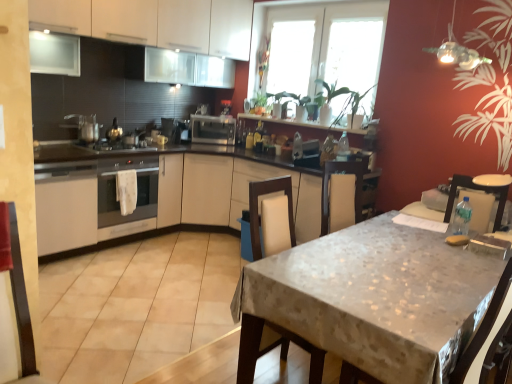
Question: Is satin silver toaster at center, the 3th appliance when ordered from right to left, positioned before white matte cabinet at upper left, the 2th cabinetry when ordered from bottom to top?

Choices:
 (A) yes
 (B) no

Answer: (B)

Question: Is satin silver toaster at center, the second appliance in the back-to-front sequence, at the left side of white matte cabinet at upper left, placed as the 1th cabinetry when sorted from top to bottom?

Choices:
 (A) yes
 (B) no

Answer: (A)

Question: Can you confirm if satin silver toaster at center, which is the second appliance from front to back, is bigger than white matte cabinet at upper left, the 2th cabinetry when ordered from bottom to top?

Choices:
 (A) yes
 (B) no

Answer: (B)

Question: From the image's perspective, would you say satin silver toaster at center, the second appliance in the back-to-front sequence, is shown under white matte cabinet at upper left, the 2th cabinetry when ordered from bottom to top?

Choices:
 (A) yes
 (B) no

Answer: (A)

Question: Is satin silver toaster at center, the second appliance in the back-to-front sequence, in contact with white matte cabinet at upper left, placed as the 1th cabinetry when sorted from top to bottom?

Choices:
 (A) yes
 (B) no

Answer: (B)

Question: From the image's perspective, is textured beige table at center located above or below satin silver toaster at center, the second appliance in the back-to-front sequence?

Choices:
 (A) below
 (B) above

Answer: (A)

Question: Is textured beige table at center inside or outside of satin silver toaster at center, the 3th appliance when ordered from right to left?

Choices:
 (A) outside
 (B) inside

Answer: (A)

Question: In the image, is textured beige table at center positioned in front of or behind satin silver toaster at center, which is the second appliance from front to back?

Choices:
 (A) behind
 (B) front

Answer: (B)

Question: Visually, is textured beige table at center positioned to the left or to the right of satin silver toaster at center, which ranks as the 1th appliance in left-to-right order?

Choices:
 (A) left
 (B) right

Answer: (B)

Question: Is transparent glass window at upper center, the second window viewed from the right, inside or outside of satin silver toaster at center, the second appliance in the back-to-front sequence?

Choices:
 (A) outside
 (B) inside

Answer: (A)

Question: Considering the positions of transparent glass window at upper center, acting as the first window starting from the left, and satin silver toaster at center, the second appliance in the back-to-front sequence, in the image, is transparent glass window at upper center, acting as the first window starting from the left, wider or thinner than satin silver toaster at center, the second appliance in the back-to-front sequence,?

Choices:
 (A) thin
 (B) wide

Answer: (A)

Question: From the image's perspective, is transparent glass window at upper center, acting as the first window starting from the left, above or below satin silver toaster at center, which ranks as the 1th appliance in left-to-right order?

Choices:
 (A) below
 (B) above

Answer: (B)

Question: From a real-world perspective, is transparent glass window at upper center, the second window viewed from the right, positioned above or below satin silver toaster at center, the second appliance in the back-to-front sequence?

Choices:
 (A) above
 (B) below

Answer: (A)

Question: Which is correct: white fabric swivel chair at right, the 2th swivel chair when ordered from left to right, is inside satin silver toaster at center, the first appliance viewed from the right, or outside of it?

Choices:
 (A) inside
 (B) outside

Answer: (B)

Question: Is white fabric swivel chair at right, the 2th swivel chair when ordered from left to right, bigger or smaller than satin silver toaster at center, the first appliance when ordered from back to front?

Choices:
 (A) small
 (B) big

Answer: (A)